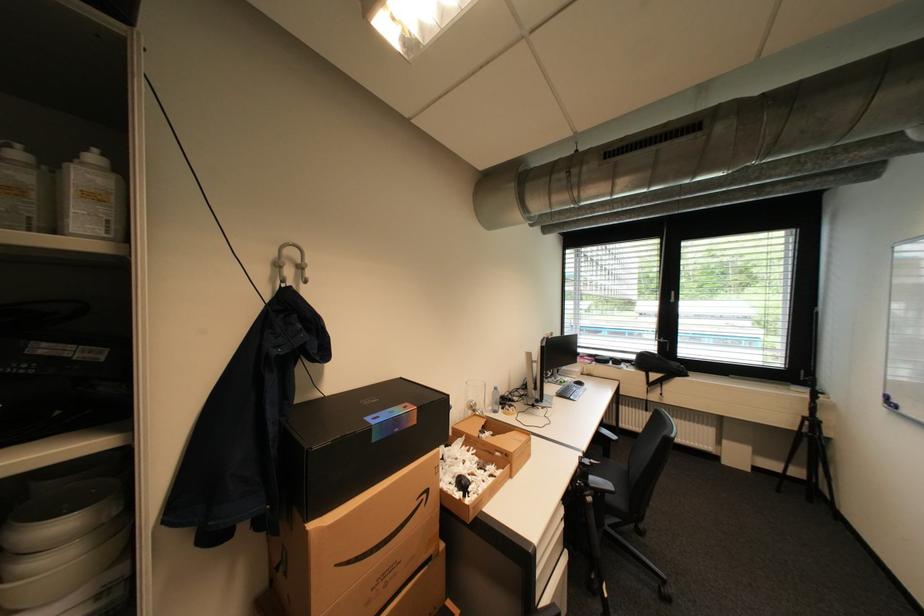
I want to click on metal wall hook, so click(290, 262).